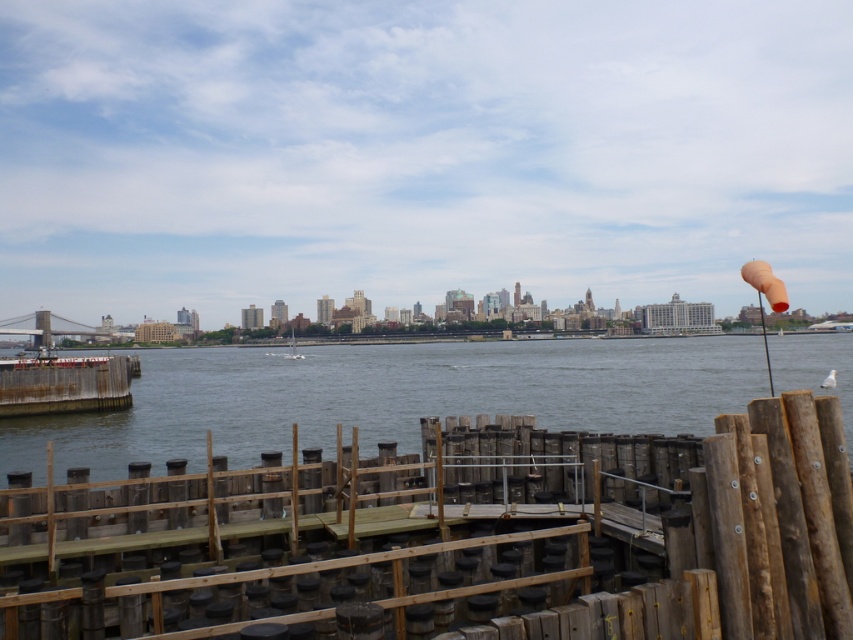
You are standing on the wooden dock and looking out towards the water. You notice two points marked on the dock. The first point is at coordinates point (198,493) and the second point is at point (289,340). Which point is closer to you?

Point (198,493) is in front of point (289,340), so it is closer to you.